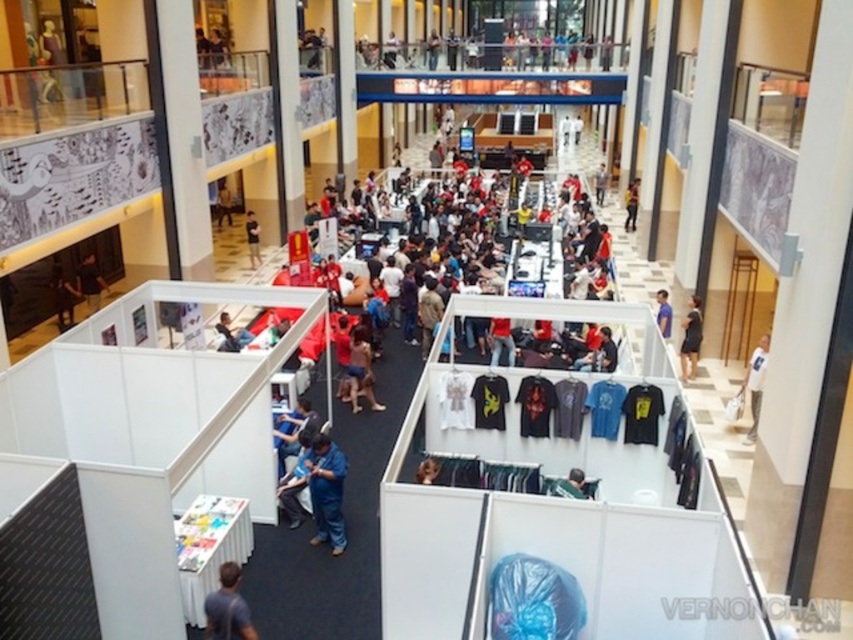
Between black fabric dress at lower right and matte black shirt at center, which one appears on the left side from the viewer's perspective?

matte black shirt at center

Does black fabric dress at lower right come in front of matte black shirt at center?

Yes, it is.

You are a GUI agent. You are given a task and a screenshot of the screen. Output one action in this format:
    pyautogui.click(x=<x>, y=<y>)
    Task: Click on the black fabric dress at lower right
    This screenshot has height=640, width=853.
    Given the screenshot: What is the action you would take?
    pyautogui.click(x=689, y=339)

Measure the distance between dark blue shirt at lower center and light brown skin at center.

dark blue shirt at lower center is 6.25 meters from light brown skin at center.

Locate an element on the screen. This screenshot has width=853, height=640. dark blue shirt at lower center is located at coordinates (227, 608).

This screenshot has width=853, height=640. What do you see at coordinates (361, 371) in the screenshot?
I see `light brown skin at center` at bounding box center [361, 371].

Which is more to the right, light brown skin at center or white cotton shirt at center?

white cotton shirt at center

Who is more distant from viewer, [354,349] or [740,388]?

The point [740,388] is more distant.

Locate an element on the screen. The height and width of the screenshot is (640, 853). light brown skin at center is located at coordinates (361, 371).